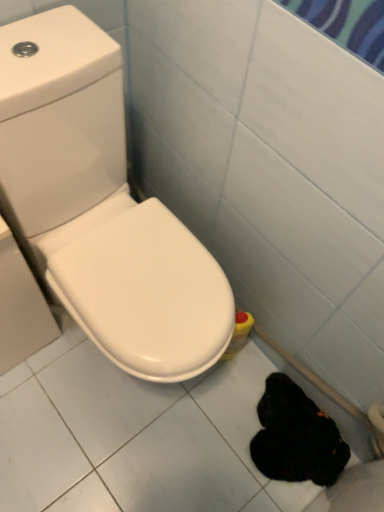
Question: Should I look upward or downward to see black fuzzy animal at lower right?

Choices:
 (A) down
 (B) up

Answer: (A)

Question: Can you confirm if white glossy toilet at center-left is taller than black fuzzy animal at lower right?

Choices:
 (A) no
 (B) yes

Answer: (B)

Question: Would you say black fuzzy animal at lower right is part of white glossy toilet at center-left's contents?

Choices:
 (A) yes
 (B) no

Answer: (B)

Question: Are white glossy toilet at center-left and black fuzzy animal at lower right making contact?

Choices:
 (A) no
 (B) yes

Answer: (A)

Question: Is white glossy toilet at center-left aimed at black fuzzy animal at lower right?

Choices:
 (A) no
 (B) yes

Answer: (B)

Question: Is white glossy toilet at center-left shorter than black fuzzy animal at lower right?

Choices:
 (A) yes
 (B) no

Answer: (B)

Question: Is white glossy toilet at center-left positioned behind black fuzzy animal at lower right?

Choices:
 (A) no
 (B) yes

Answer: (A)

Question: From a real-world perspective, is black fuzzy animal at lower right positioned over white glossy toilet at center-left based on gravity?

Choices:
 (A) no
 (B) yes

Answer: (A)

Question: Is the position of black fuzzy animal at lower right less distant than that of white glossy toilet at center-left?

Choices:
 (A) no
 (B) yes

Answer: (A)

Question: Is black fuzzy animal at lower right wider than white glossy toilet at center-left?

Choices:
 (A) no
 (B) yes

Answer: (A)

Question: Considering the relative sizes of black fuzzy animal at lower right and white glossy toilet at center-left in the image provided, is black fuzzy animal at lower right smaller than white glossy toilet at center-left?

Choices:
 (A) yes
 (B) no

Answer: (A)

Question: Is black fuzzy animal at lower right to the right of white glossy toilet at center-left from the viewer's perspective?

Choices:
 (A) no
 (B) yes

Answer: (B)

Question: From a real-world perspective, is black fuzzy animal at lower right beneath white glossy toilet at center-left?

Choices:
 (A) yes
 (B) no

Answer: (A)

Question: Choose the correct answer: Is white glossy toilet at center-left inside black fuzzy animal at lower right or outside it?

Choices:
 (A) inside
 (B) outside

Answer: (B)